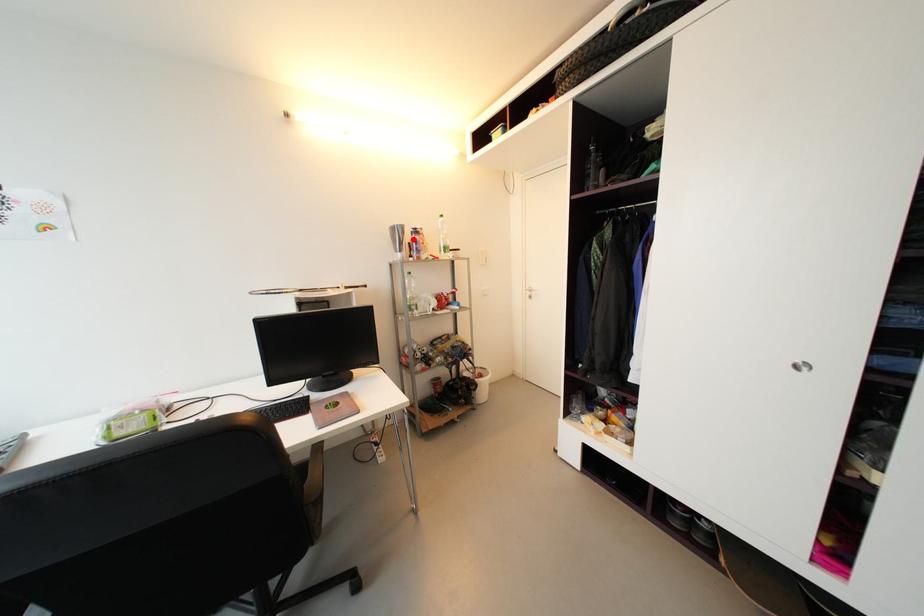
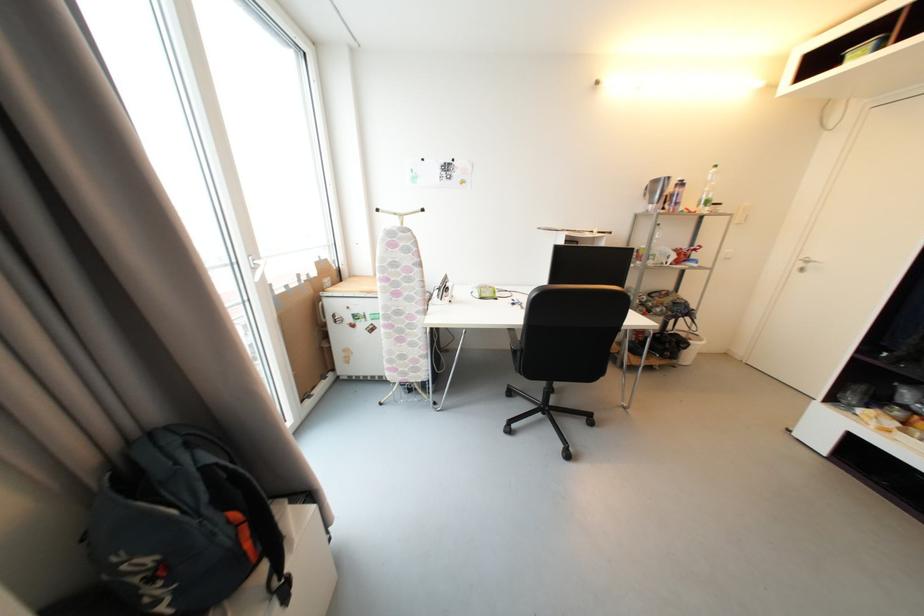
Locate, in the second image, the point that corresponds to the highlighted location in the first image.

(674, 192)